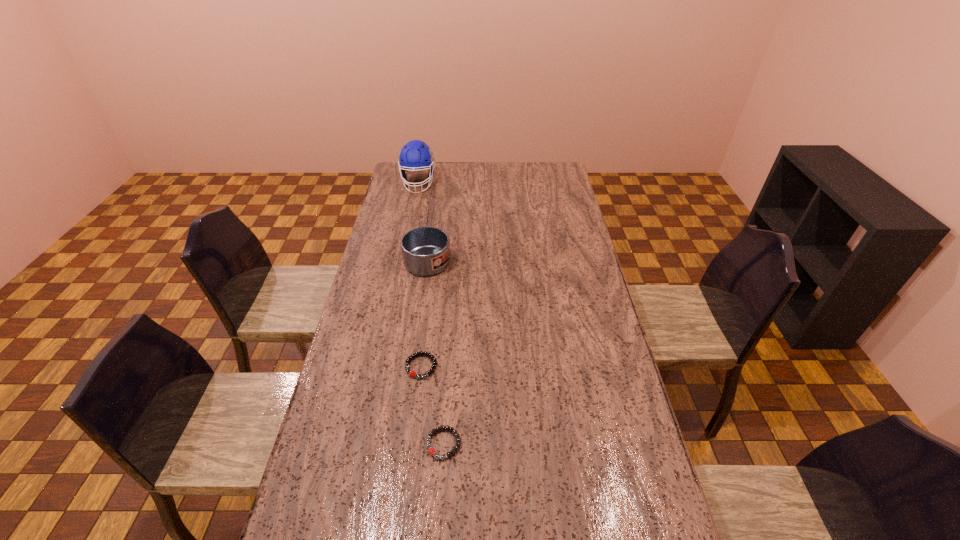
Locate an element on the screen. The image size is (960, 540). free spot located on the back of the third farthest object is located at coordinates (430, 291).

The width and height of the screenshot is (960, 540). In order to click on vacant space situated 0.080m on the right of the nearer bracelet in this screenshot , I will do `click(491, 444)`.

You are a GUI agent. You are given a task and a screenshot of the screen. Output one action in this format:
    pyautogui.click(x=<x>, y=<y>)
    Task: Click on the object present at the far edge
    This screenshot has height=540, width=960.
    Given the screenshot: What is the action you would take?
    pyautogui.click(x=416, y=155)

Identify the location of football helmet that is at the left edge. This screenshot has height=540, width=960. (416, 155).

Image resolution: width=960 pixels, height=540 pixels. Find the location of `saucepan present at the left edge`. saucepan present at the left edge is located at coordinates (426, 250).

In order to click on object at the far left corner in this screenshot , I will do point(416,155).

At what (x,y) coordinates should I click in order to perform the action: click on vacant region at the left edge of the desktop. Please return your answer as a coordinate pair (x, y). The width and height of the screenshot is (960, 540). Looking at the image, I should click on (380, 276).

In order to click on vacant area at the right edge in this screenshot , I will do `click(573, 201)`.

Image resolution: width=960 pixels, height=540 pixels. I want to click on vacant region at the far right corner of the desktop, so click(546, 172).

Find the location of a particular element. The height and width of the screenshot is (540, 960). free spot between the nearest object and the third farthest object is located at coordinates (432, 405).